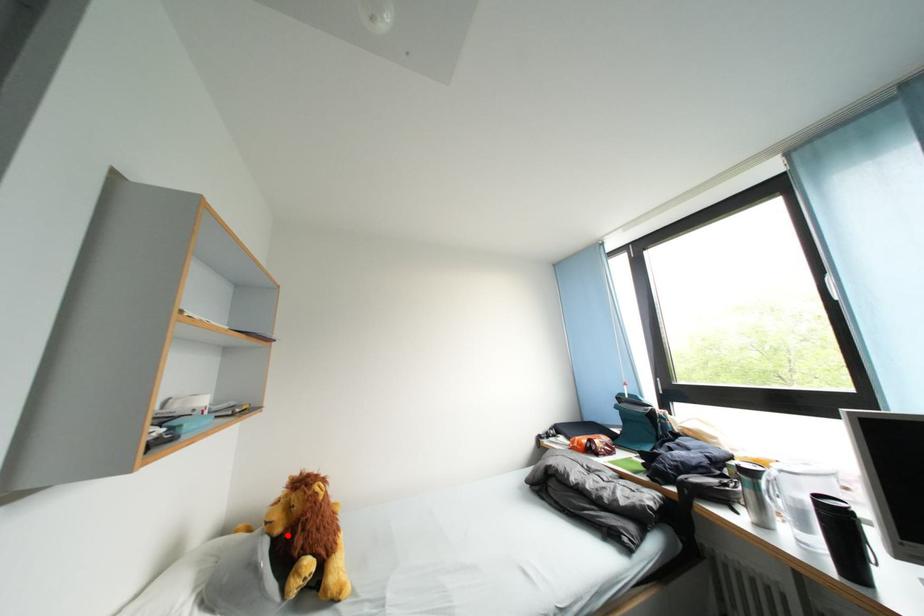
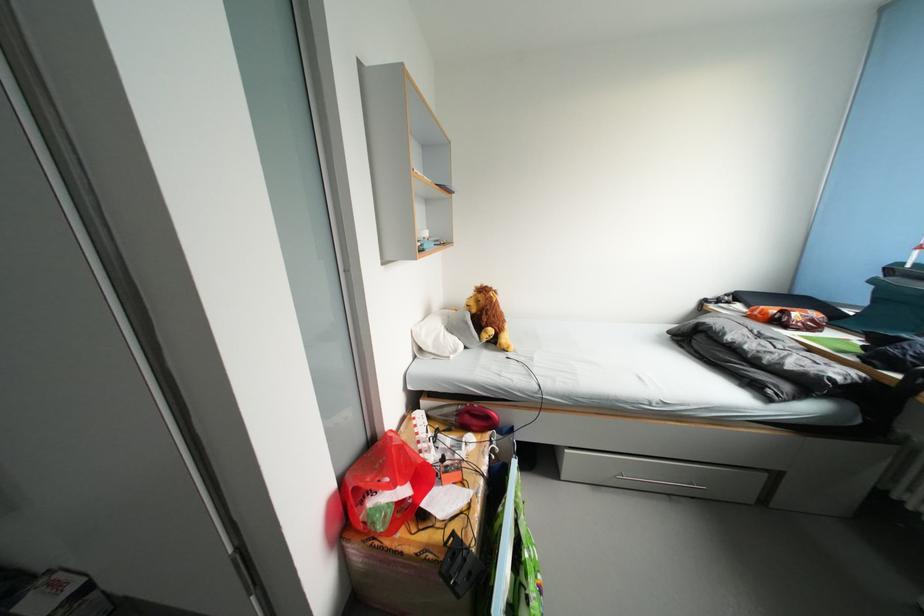
Question: I am providing you with two images of the same scene from different viewpoints. A red point is marked on the first image. At the location where the point appears in image 1, is it still visible in image 2?

Choices:
 (A) Yes
 (B) No

Answer: (A)